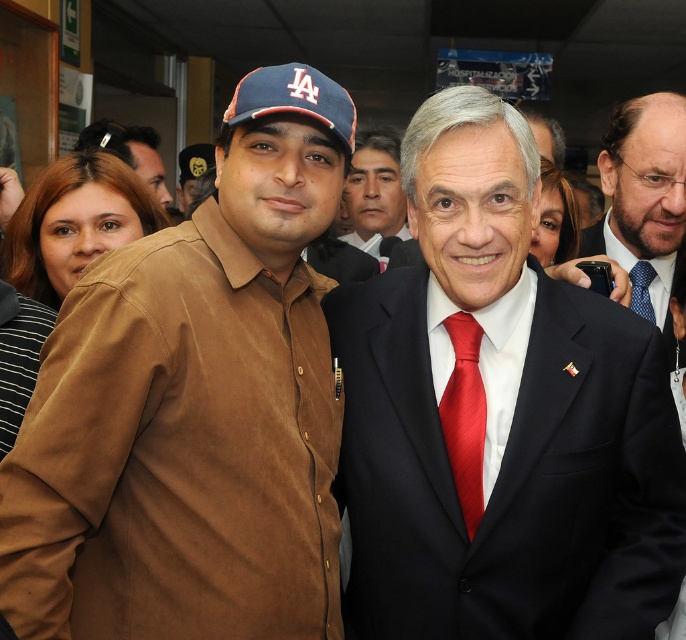
Which is below, satin red tie at center or blue fabric baseball cap at left?

Positioned lower is satin red tie at center.

Who is taller, satin red tie at center or blue fabric baseball cap at left?

Standing taller between the two is satin red tie at center.

Identify the location of satin red tie at center. (464, 417).

Is blue dotted tie at center bigger than satin red tie at center?

Correct, blue dotted tie at center is larger in size than satin red tie at center.

Between blue dotted tie at center and satin red tie at center, which one appears on the left side from the viewer's perspective?

satin red tie at center is more to the left.

Which is in front, point (657, 208) or point (460, 472)?

Positioned in front is point (460, 472).

Where is `blue dotted tie at center`? blue dotted tie at center is located at coordinates (643, 196).

Is satin red tie at center to the left of blue dotted tie at right from the viewer's perspective?

Indeed, satin red tie at center is positioned on the left side of blue dotted tie at right.

Does satin red tie at center have a greater height compared to blue dotted tie at right?

Yes, satin red tie at center is taller than blue dotted tie at right.

At what (x,y) coordinates should I click in order to perform the action: click on satin red tie at center. Please return your answer as a coordinate pair (x, y). The height and width of the screenshot is (640, 686). Looking at the image, I should click on (464, 417).